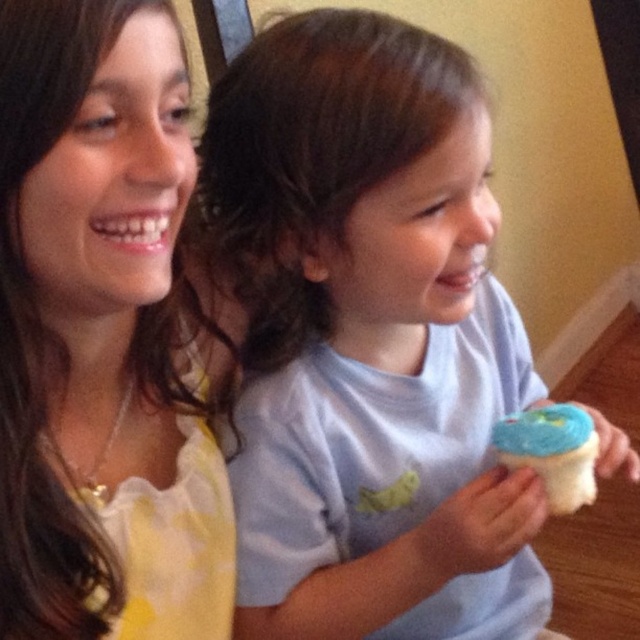
You are taking a photo of the scene and want to ensure the point at coordinates point (355,28) is in focus. Given that your camera has a depth of field that can sharply focus objects within 20 inches from the camera, will the point be in focus?

The point (355,28) is 21.87 inches from the camera, which is beyond the 20 inches depth of field range. Therefore, the point will not be in focus.

You are a photographer trying to capture the perfect shot of the white matte cupcake at center. The cupcake is located at point (369, 339). If you move your camera 0.1 units to the right along the x axis, will you still be able to see the white matte cupcake at center in your frame?

Moving 0.1 units to the right along the x axis from point (369, 339) would place the camera at 0.630, 0.577. Since the white matte cupcake at center is located precisely at the original point, moving the camera to the right would shift the frame away from the cupcake, making it no longer visible in the center. Therefore, the cupcake would not be visible in the frame anymore.

You are a photographer trying to capture a closeup of the white matte cupcake at center and the matte yellow shirt at upper left. Which object should you focus on first to ensure it appears sharp in the photo?

The white matte cupcake at center is closer to the viewer than the matte yellow shirt at upper left, so you should focus on the white matte cupcake at center first to ensure it appears sharp.